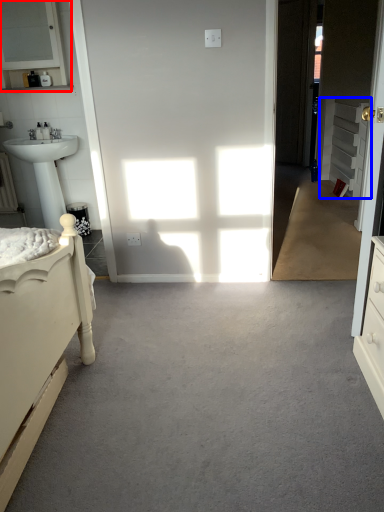
Question: Which object appears farthest to the camera in this image, medicine cabinet (highlighted by a red box) or cabinetry (highlighted by a blue box)?

Choices:
 (A) medicine cabinet
 (B) cabinetry

Answer: (B)